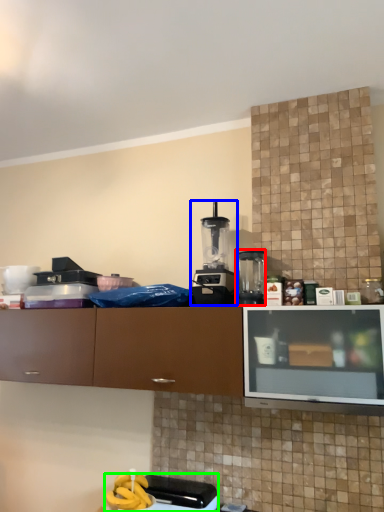
Question: Which is nearer to the kitchen appliance (highlighted by a red box)? kitchen appliance (highlighted by a blue box) or appliance (highlighted by a green box).

Choices:
 (A) kitchen appliance
 (B) appliance

Answer: (A)